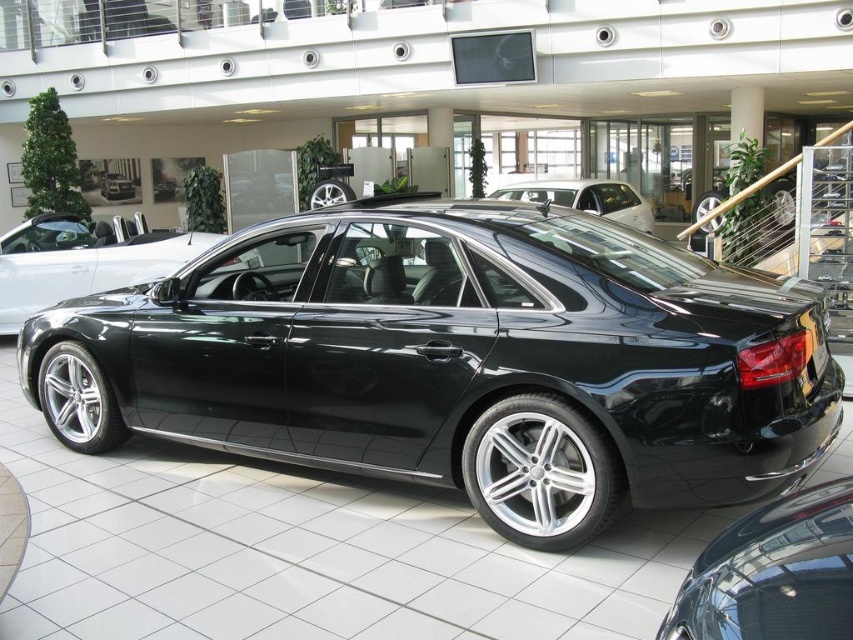
Question: Does matte black car at center have a smaller size compared to black metallic sedan at center?

Choices:
 (A) yes
 (B) no

Answer: (B)

Question: Which of the following is the farthest from the observer?

Choices:
 (A) (119, 259)
 (B) (730, 544)
 (C) (328, 452)

Answer: (A)

Question: In this image, where is shiny black sedan at center located relative to matte black car at center?

Choices:
 (A) left
 (B) right

Answer: (A)

Question: Among these points, which one is nearest to the camera?

Choices:
 (A) (171, 269)
 (B) (659, 637)
 (C) (115, 180)

Answer: (B)

Question: Can you confirm if glossy black sedan at center is wider than matte black car at center?

Choices:
 (A) yes
 (B) no

Answer: (B)

Question: Estimate the real-world distances between objects in this image. Which object is farther from the glossy black sedan at center?

Choices:
 (A) shiny black sedan at center
 (B) matte black car at center
 (C) glossy black car at center

Answer: (C)